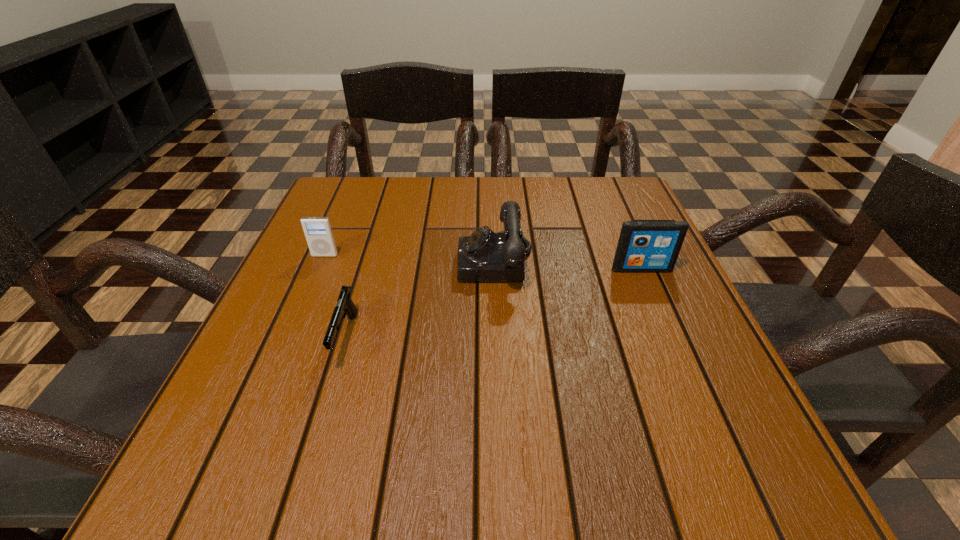
Image resolution: width=960 pixels, height=540 pixels. In order to click on vacant region between the telephone and the rightmost object in this screenshot , I will do `click(568, 266)`.

Identify the location of free spot between the third object from left to right and the gun. (420, 300).

Choose which object is the third nearest neighbor to the telephone. Please provide its 2D coordinates. Your answer should be formatted as a tuple, i.e. [(x, y)], where the tuple contains the x and y coordinates of a point satisfying the conditions above.

[(318, 232)]

Locate an element on the screen. the second closest object to the left iPod is located at coordinates (485, 256).

The width and height of the screenshot is (960, 540). What are the coordinates of `free location that satisfies the following two spatial constraints: 1. on the dial of the telephone; 2. at the aiming end of the shortest object` in the screenshot? It's located at (499, 338).